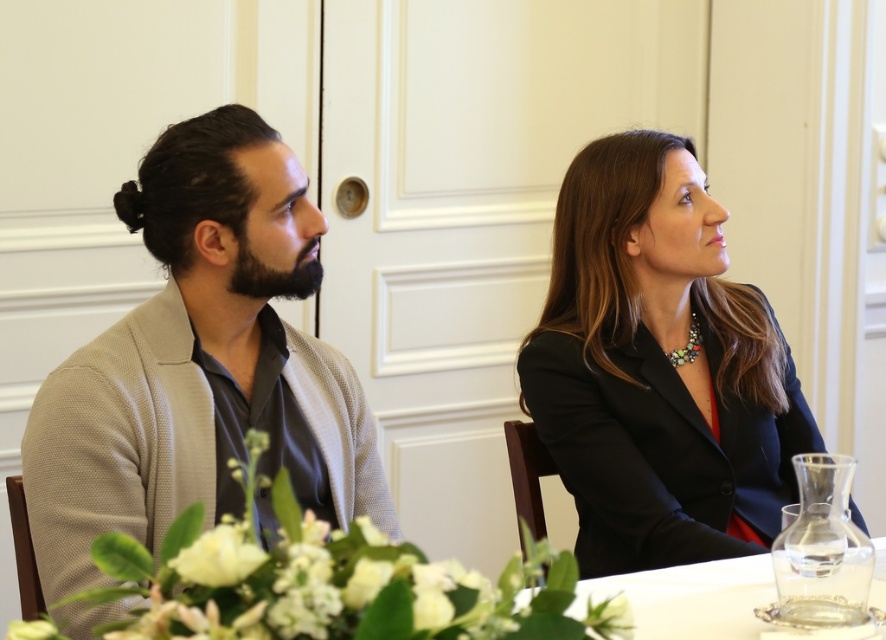
You are a photographer setting up for a professional photoshoot in this conference room. You need to place a small decorative item between the beige textured cardigan at left and the clear glass water at lower center. Based on their current positions, where should you place the item to ensure it is centered between them?

The beige textured cardigan at left is positioned on the left side of clear glass water at lower center, so placing the small decorative item directly between them would require positioning it closer to the center of the table, midway between the cardigan and the water.

You are sitting at the table and want to reach for the clear glass water at lower center without touching the matte black blazer at center. Is this possible?

The matte black blazer at center is further to the viewer than clear glass water at lower center, so yes, you can reach the clear glass water at lower center without touching the matte black blazer at center since it is closer to you.